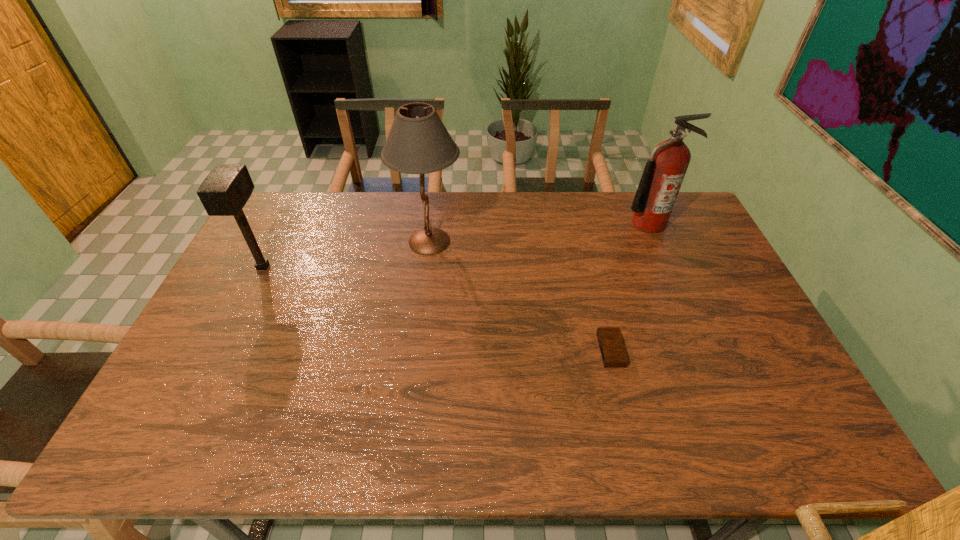
Locate an element on the screen. blank region between the rightmost object and the mallet is located at coordinates pos(456,245).

Where is `vacant space that is in between the table lamp and the rightmost object`? The height and width of the screenshot is (540, 960). vacant space that is in between the table lamp and the rightmost object is located at coordinates (539, 233).

Identify which object is the second nearest to the fire extinguisher. Please provide its 2D coordinates. Your answer should be formatted as a tuple, i.e. [(x, y)], where the tuple contains the x and y coordinates of a point satisfying the conditions above.

[(418, 143)]

You are a GUI agent. You are given a task and a screenshot of the screen. Output one action in this format:
    pyautogui.click(x=<x>, y=<y>)
    Task: Click on the object that is the closest to the shortest object
    The height and width of the screenshot is (540, 960).
    Given the screenshot: What is the action you would take?
    pyautogui.click(x=664, y=172)

Locate an element on the screen. free space that satisfies the following two spatial constraints: 1. on the front of the fire extinguisher near the operation label; 2. on the front face of the second object from right to left is located at coordinates (703, 350).

In order to click on vacant space that satisfies the following two spatial constraints: 1. on the front of the rightmost object near the operation label; 2. on the front face of the nearest object in this screenshot , I will do `click(703, 350)`.

Locate an element on the screen. The width and height of the screenshot is (960, 540). vacant area that satisfies the following two spatial constraints: 1. on the front of the rightmost object near the operation label; 2. on the front-facing side of the table lamp is located at coordinates (656, 241).

This screenshot has width=960, height=540. Find the location of `free space that satisfies the following two spatial constraints: 1. on the front of the rightmost object near the operation label; 2. on the front-facing side of the table lamp`. free space that satisfies the following two spatial constraints: 1. on the front of the rightmost object near the operation label; 2. on the front-facing side of the table lamp is located at coordinates (656, 241).

Where is `blank area in the image that satisfies the following two spatial constraints: 1. on the front of the rightmost object near the operation label; 2. on the front face of the second object from right to left`? The width and height of the screenshot is (960, 540). blank area in the image that satisfies the following two spatial constraints: 1. on the front of the rightmost object near the operation label; 2. on the front face of the second object from right to left is located at coordinates (703, 350).